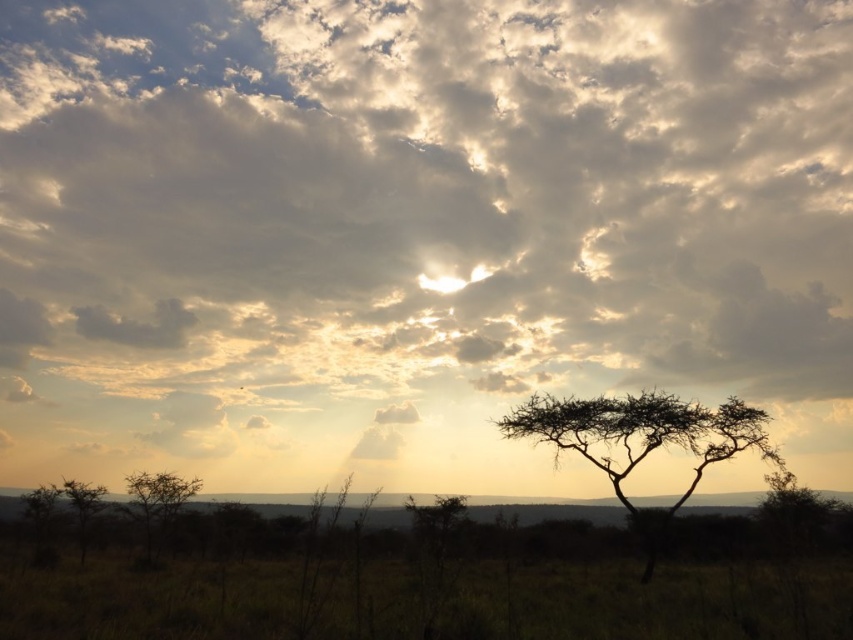
You are an artist trying to paint the scene. You want to ensure the silhouette wood tree at center is proportionally accurate compared to the green leafy tree at lower left. Which tree should you draw taller in your painting?

The green leafy tree at lower left should be drawn taller in the painting since the silhouette wood tree at center is not as tall as it.

You are standing at the edge of the landscape looking towards the sun. Which tree, the silhouette wood tree at center or the green leafy tree at lower left, blocks your view of the sun?

The silhouette wood tree at center blocks your view of the sun because it is in front of the green leafy tree at lower left.